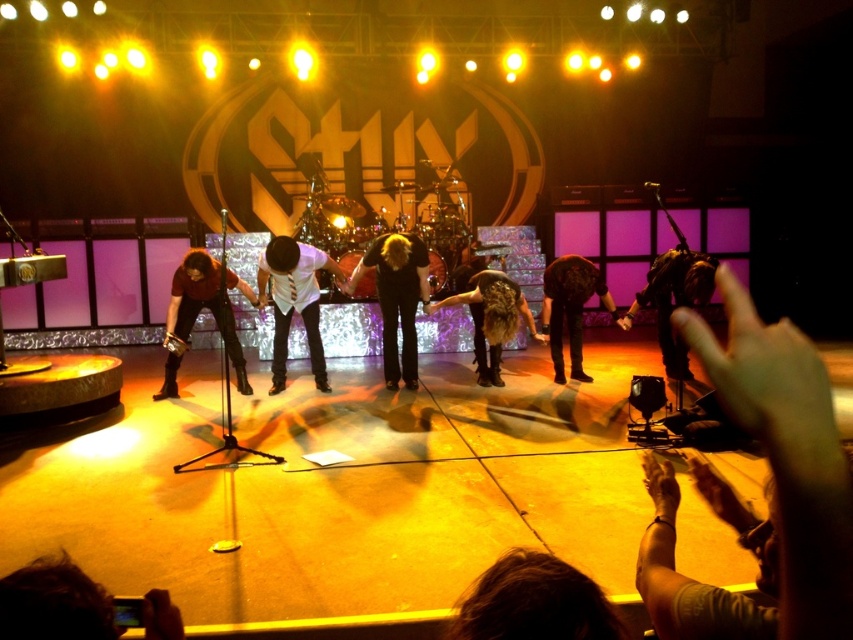
Question: Which of these objects is positioned closest to the white glossy shirt at center?

Choices:
 (A) leather jacket at center
 (B) dark brown leather jacket at right

Answer: (A)

Question: Which is farther from the leather jacket at center?

Choices:
 (A) dark brown leather jacket at right
 (B) shiny brown hair at center
 (C) white glossy shirt at center
 (D) black leather pants at center

Answer: (C)

Question: From the image, what is the correct spatial relationship of black leather pants at center in relation to shiny brown hair at center?

Choices:
 (A) left
 (B) right

Answer: (A)

Question: Which point is farther from the camera taking this photo?

Choices:
 (A) [173, 346]
 (B) [561, 292]

Answer: (B)

Question: Considering the relative positions of white glossy shirt at center and matte brown leather jacket at lower left in the image provided, where is white glossy shirt at center located with respect to matte brown leather jacket at lower left?

Choices:
 (A) below
 (B) above

Answer: (B)

Question: Is black leather pants at center thinner than shiny brown hair at center?

Choices:
 (A) no
 (B) yes

Answer: (B)